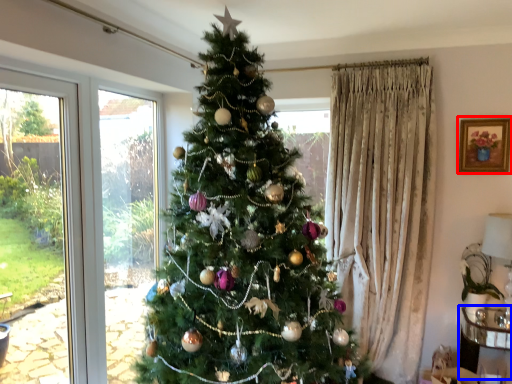
Question: Which of the following is the farthest to the observer, picture frame (highlighted by a red box) or furniture (highlighted by a blue box)?

Choices:
 (A) picture frame
 (B) furniture

Answer: (A)